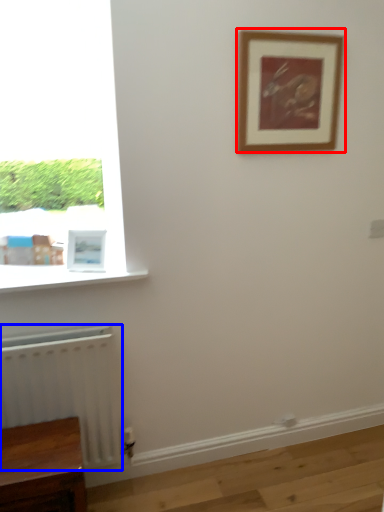
Question: Which point is closer to the camera, picture frame (highlighted by a red box) or radiator (highlighted by a blue box)?

Choices:
 (A) picture frame
 (B) radiator

Answer: (B)